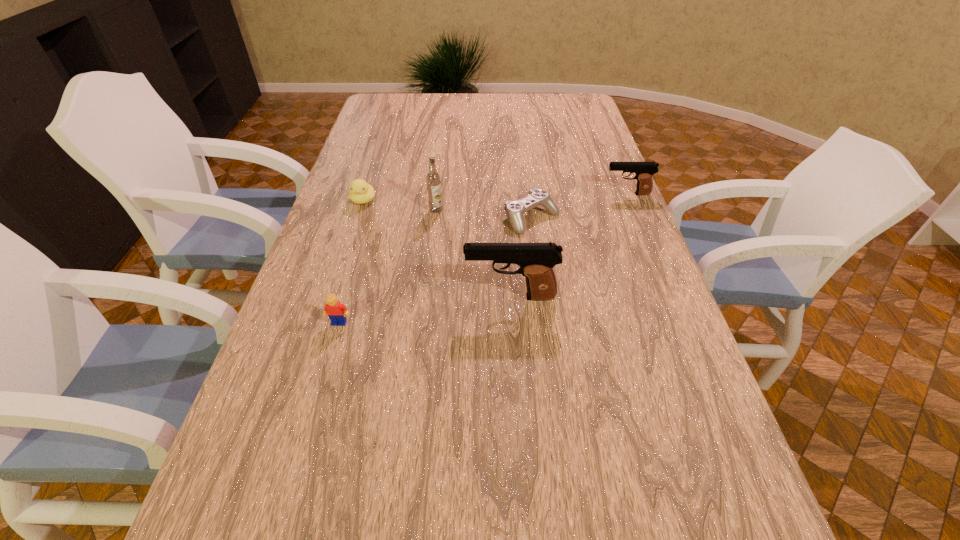
The height and width of the screenshot is (540, 960). Find the location of `object at the right edge`. object at the right edge is located at coordinates (644, 171).

Where is `vacant space at the far edge of the desktop`? vacant space at the far edge of the desktop is located at coordinates (502, 98).

Identify the location of vacant space at the near edge of the desktop. (355, 458).

In the image, there is a desktop. Where is `vacant space at the left edge`? vacant space at the left edge is located at coordinates (283, 355).

Where is `free space at the right edge of the desktop`? Image resolution: width=960 pixels, height=540 pixels. free space at the right edge of the desktop is located at coordinates (694, 403).

Where is `free spot between the duckling and the shortest object`? This screenshot has height=540, width=960. free spot between the duckling and the shortest object is located at coordinates (447, 210).

Find the location of a particular element. The width and height of the screenshot is (960, 540). blank region between the control and the fourth object from right to left is located at coordinates (484, 214).

The width and height of the screenshot is (960, 540). I want to click on empty location between the Lego and the vodka, so click(388, 266).

Image resolution: width=960 pixels, height=540 pixels. Identify the location of vacant area between the nearest object and the taller pistol. (424, 310).

Select which object is the fourth closest to the fourth object from right to left. Please provide its 2D coordinates. Your answer should be formatted as a tuple, i.e. [(x, y)], where the tuple contains the x and y coordinates of a point satisfying the conditions above.

[(337, 312)]